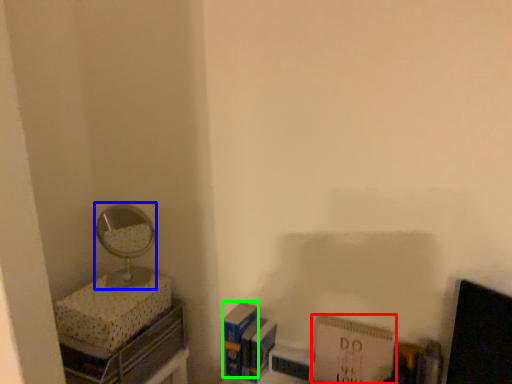
Question: Estimate the real-world distances between objects in this image. Which object is closer to paperback book (highlighted by a red box), mirror (highlighted by a blue box) or paperback book (highlighted by a green box)?

Choices:
 (A) mirror
 (B) paperback book

Answer: (B)